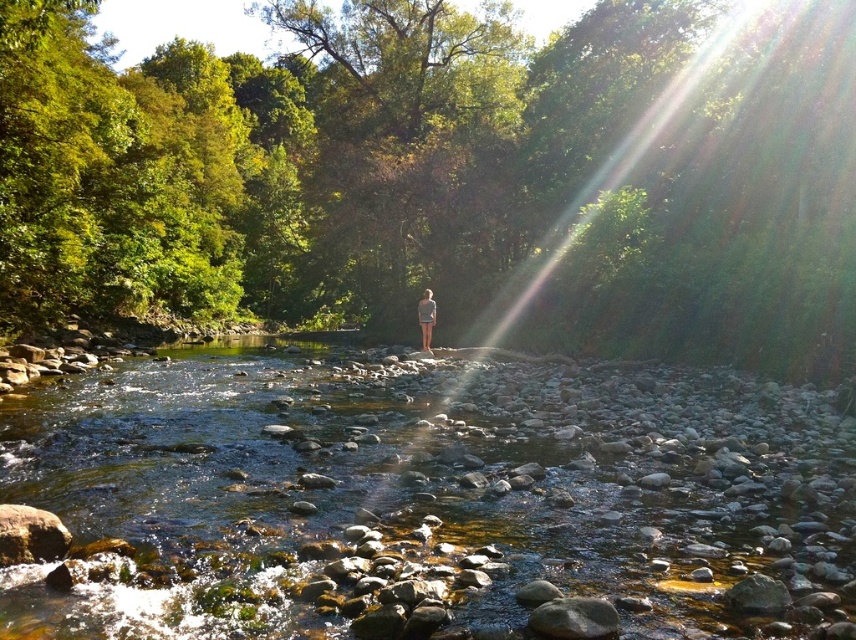
Question: Among these points, which one is nearest to the camera?

Choices:
 (A) (794, 145)
 (B) (421, 323)

Answer: (A)

Question: Which point is closer to the camera?

Choices:
 (A) light blue denim shorts at center
 (B) green leafy tree at center
 (C) clear water at center

Answer: (C)

Question: Is green leafy tree at center behind clear water at center?

Choices:
 (A) yes
 (B) no

Answer: (A)

Question: Among these objects, which one is nearest to the camera?

Choices:
 (A) light blue denim shorts at center
 (B) green leafy tree at center
 (C) clear water at center

Answer: (C)

Question: From the image, what is the correct spatial relationship of green leafy tree at center in relation to light blue denim shorts at center?

Choices:
 (A) right
 (B) left

Answer: (B)

Question: Does green leafy tree at center have a lesser width compared to clear water at center?

Choices:
 (A) yes
 (B) no

Answer: (B)